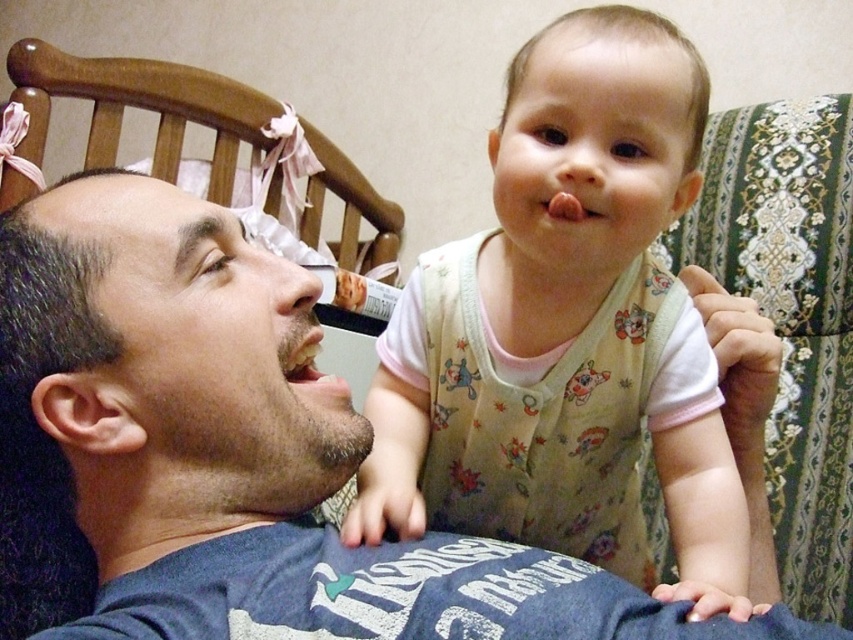
You are holding a 12 inch long ruler. You want to measure the distance between the point at coordinates (111, 445) and the camera. Can you do it with the ruler?

The distance between the point at coordinates (111, 445) and the camera is 22.61 inches. Since the ruler is only 12 inches long, it is not long enough to measure the distance between the point at coordinates (111, 445) and the camera.